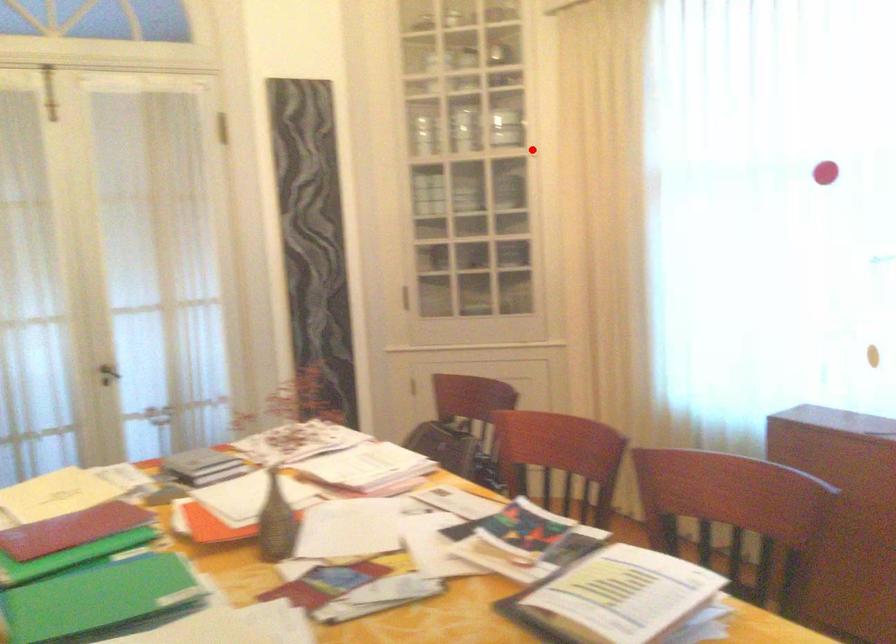
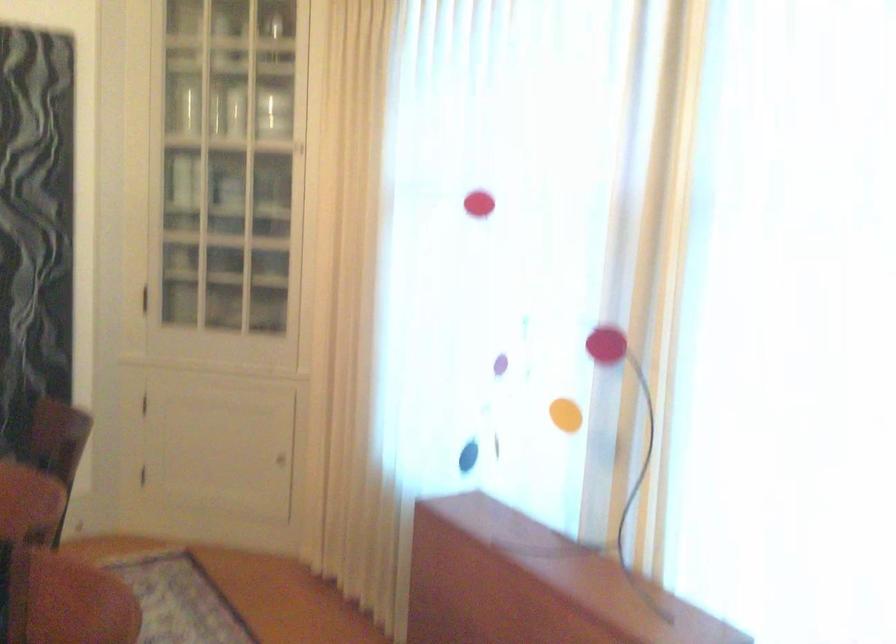
Question: A red point is marked in image1. In image2, is the corresponding 3D point closer to the camera or farther? Reply with the corresponding letter.

Choices:
 (A) The corresponding 3D point is closer.
 (B) The corresponding 3D point is farther.

Answer: (A)